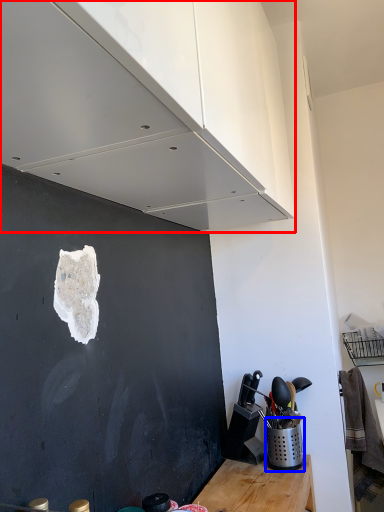
Question: Which point is further to the camera, cabinetry (highlighted by a red box) or appliance (highlighted by a blue box)?

Choices:
 (A) cabinetry
 (B) appliance

Answer: (B)